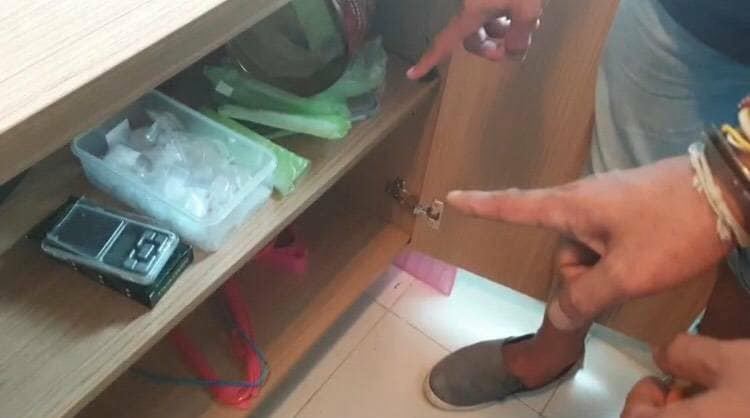
Identify the location of tabletop. (45, 61).